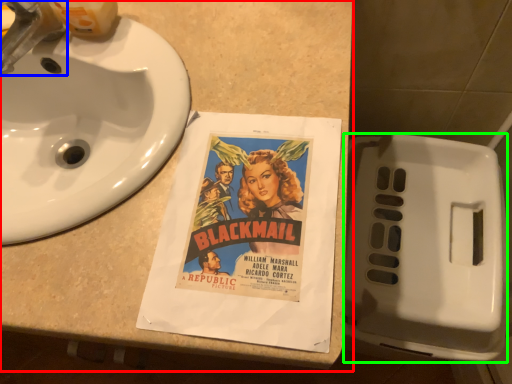
Question: Which is farther away from counter top (highlighted by a red box)? faucet (highlighted by a blue box) or toilet (highlighted by a green box)?

Choices:
 (A) faucet
 (B) toilet

Answer: (B)